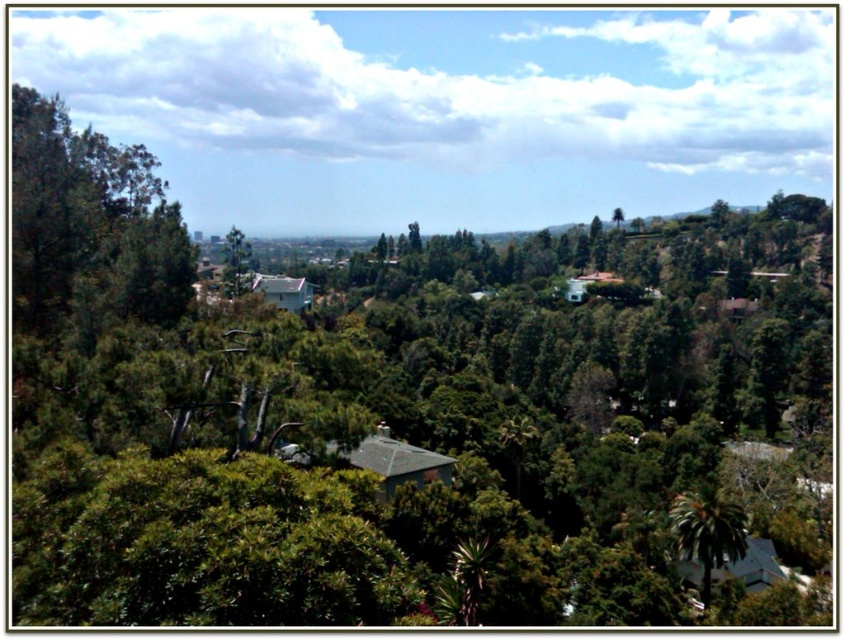
You are a landscape architect designing a garden path between the green leafy palm tree at lower right and the green leafy tree at upper center. Which tree should you consider for a narrower pathway design?

The green leafy palm tree at lower right is thinner than the green leafy tree at upper center, so the narrower pathway should be designed around the green leafy palm tree at lower right to accommodate its smaller width.

You are standing in the lush landscape and want to take a photo of the green leafy palm tree at lower right without the green leafy tree at center blocking the view. Which direction should you move to ensure the palm tree is visible?

Move away from the green leafy tree at center so that the green leafy palm tree at lower right is no longer obstructed by it.